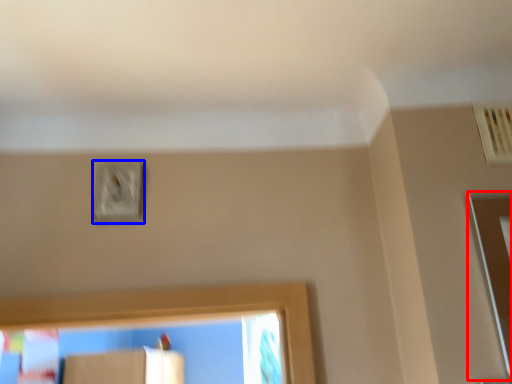
Question: Which of the following is the farthest to the observer, screen door (highlighted by a red box) or light switch (highlighted by a blue box)?

Choices:
 (A) screen door
 (B) light switch

Answer: (B)